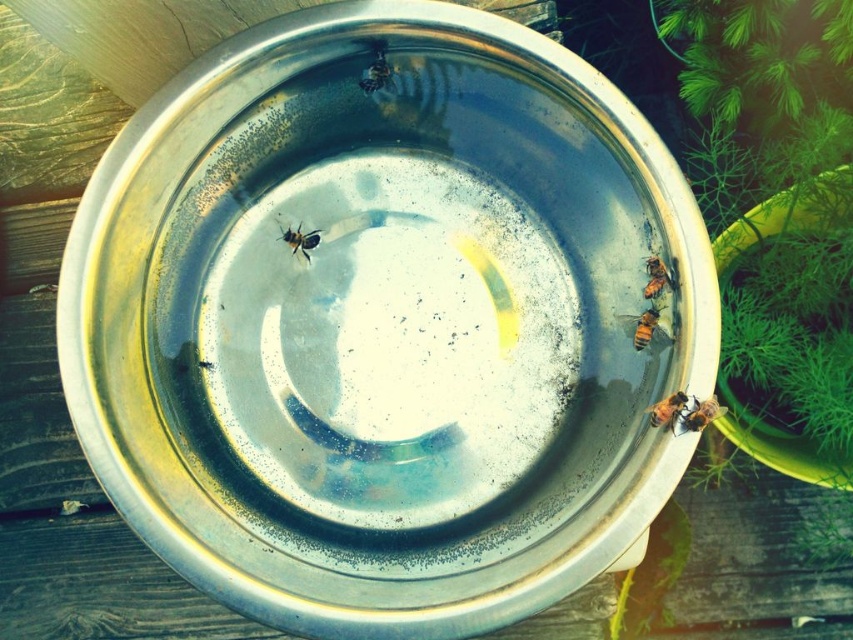
Question: In this image, where is translucent yellowish honeybee at right located relative to translucent yellowish honeybee at bottom right?

Choices:
 (A) left
 (B) right

Answer: (A)

Question: Which object is positioned closest to the translucent yellowish honeybee at lower right?

Choices:
 (A) translucent yellowish honeybee at center
 (B) translucent yellowish honeybee at right
 (C) translucent orange bee at right
 (D) shiny metallic bee at center

Answer: (B)

Question: Can you confirm if translucent orange bee at right is positioned above translucent yellowish honeybee at center?

Choices:
 (A) no
 (B) yes

Answer: (A)

Question: Is translucent yellowish honeybee at right in front of translucent orange bee at right?

Choices:
 (A) no
 (B) yes

Answer: (A)

Question: Among these points, which one is farthest from the camera?

Choices:
 (A) (381, 86)
 (B) (708, 400)
 (C) (294, 236)
 (D) (662, 275)

Answer: (C)

Question: Which object is closer to the camera taking this photo?

Choices:
 (A) translucent yellowish honeybee at lower right
 (B) shiny metallic bee at center
 (C) translucent yellowish honeybee at right
 (D) translucent yellowish honeybee at center

Answer: (A)